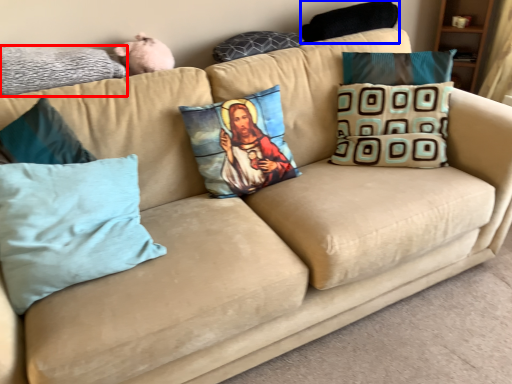
Question: Among these objects, which one is farthest to the camera, pillow (highlighted by a red box) or pillow (highlighted by a blue box)?

Choices:
 (A) pillow
 (B) pillow

Answer: (B)